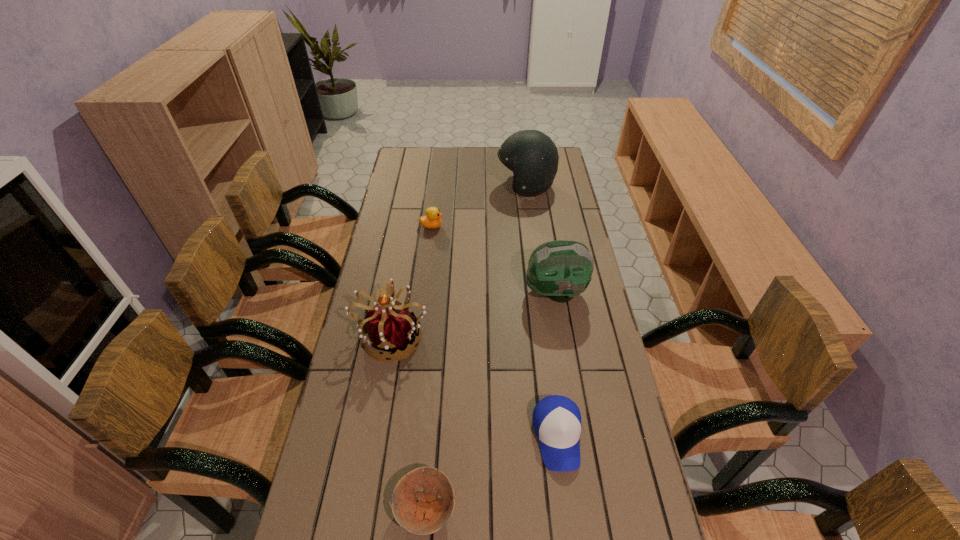
Identify the location of free space between the shorter football helmet and the fifth nearest object. (493, 259).

Locate an element on the screen. The width and height of the screenshot is (960, 540). empty space between the shorter football helmet and the tiara is located at coordinates (474, 314).

Locate which object is the third closest to the baseball cap. Please provide its 2D coordinates. Your answer should be formatted as a tuple, i.e. [(x, y)], where the tuple contains the x and y coordinates of a point satisfying the conditions above.

[(561, 270)]

Image resolution: width=960 pixels, height=540 pixels. Find the location of `object that is the fifth closest to the nearest object`. object that is the fifth closest to the nearest object is located at coordinates (532, 156).

At what (x,y) coordinates should I click in order to perform the action: click on free point that satisfies the following two spatial constraints: 1. on the face of the duckling; 2. on the front-facing side of the tiara. Please return your answer as a coordinate pair (x, y). Looking at the image, I should click on (419, 335).

The width and height of the screenshot is (960, 540). In order to click on vacant space that satisfies the following two spatial constraints: 1. on the visor of the shorter football helmet; 2. on the front-facing side of the tiara in this screenshot , I will do `click(563, 335)`.

You are a GUI agent. You are given a task and a screenshot of the screen. Output one action in this format:
    pyautogui.click(x=<x>, y=<y>)
    Task: Click on the vacant space that satisfies the following two spatial constraints: 1. at the face opening of the farthest object; 2. on the front-facing side of the second nearest object
    
    Given the screenshot: What is the action you would take?
    pyautogui.click(x=559, y=436)

Where is `free space that satisfies the following two spatial constraints: 1. at the face opening of the farthest object; 2. on the front-facing side of the fifth farthest object`? Image resolution: width=960 pixels, height=540 pixels. free space that satisfies the following two spatial constraints: 1. at the face opening of the farthest object; 2. on the front-facing side of the fifth farthest object is located at coordinates (559, 436).

This screenshot has width=960, height=540. Find the location of `vacant area that satisfies the following two spatial constraints: 1. at the face opening of the farthest object; 2. on the front-facing side of the tiara`. vacant area that satisfies the following two spatial constraints: 1. at the face opening of the farthest object; 2. on the front-facing side of the tiara is located at coordinates pyautogui.click(x=545, y=335).